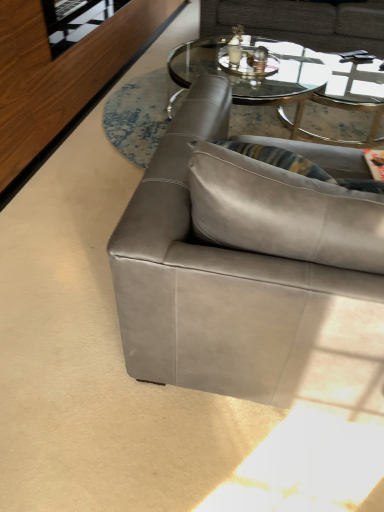
Question: From a real-world perspective, is suede gray couch at center, the 2th studio couch when ordered from back to front, positioned under gray leather couch at upper center, which appears as the second studio couch when ordered from the bottom, based on gravity?

Choices:
 (A) no
 (B) yes

Answer: (A)

Question: Can you confirm if suede gray couch at center, acting as the second studio couch starting from the top, is wider than gray leather couch at upper center, placed as the 1th studio couch when sorted from top to bottom?

Choices:
 (A) no
 (B) yes

Answer: (A)

Question: From the image's perspective, is suede gray couch at center, positioned as the 1th studio couch in front-to-back order, beneath gray leather couch at upper center, acting as the second studio couch starting from the front?

Choices:
 (A) no
 (B) yes

Answer: (B)

Question: Are suede gray couch at center, positioned as the 1th studio couch in front-to-back order, and gray leather couch at upper center, the first studio couch positioned from the back, far apart?

Choices:
 (A) no
 (B) yes

Answer: (B)

Question: Is suede gray couch at center, the 2th studio couch when ordered from back to front, next to gray leather couch at upper center, placed as the 1th studio couch when sorted from top to bottom, and touching it?

Choices:
 (A) yes
 (B) no

Answer: (B)

Question: From the image's perspective, is suede gray couch at center, positioned as the 1th studio couch in front-to-back order, above gray leather couch at upper center, which appears as the second studio couch when ordered from the bottom?

Choices:
 (A) yes
 (B) no

Answer: (B)

Question: Is transparent glass door at upper left at the back of suede gray couch at center, arranged as the first studio couch when ordered from the bottom?

Choices:
 (A) yes
 (B) no

Answer: (B)

Question: Is suede gray couch at center, positioned as the 1th studio couch in front-to-back order, in contact with transparent glass door at upper left?

Choices:
 (A) no
 (B) yes

Answer: (A)

Question: From a real-world perspective, is suede gray couch at center, the 2th studio couch when ordered from back to front, on transparent glass door at upper left?

Choices:
 (A) yes
 (B) no

Answer: (B)

Question: Considering the relative sizes of suede gray couch at center, positioned as the 1th studio couch in front-to-back order, and transparent glass door at upper left in the image provided, is suede gray couch at center, positioned as the 1th studio couch in front-to-back order, thinner than transparent glass door at upper left?

Choices:
 (A) no
 (B) yes

Answer: (A)

Question: From the image's perspective, is suede gray couch at center, arranged as the first studio couch when ordered from the bottom, beneath transparent glass door at upper left?

Choices:
 (A) yes
 (B) no

Answer: (A)

Question: Can you confirm if transparent glass coffee table at center is thinner than transparent glass door at upper left?

Choices:
 (A) yes
 (B) no

Answer: (B)